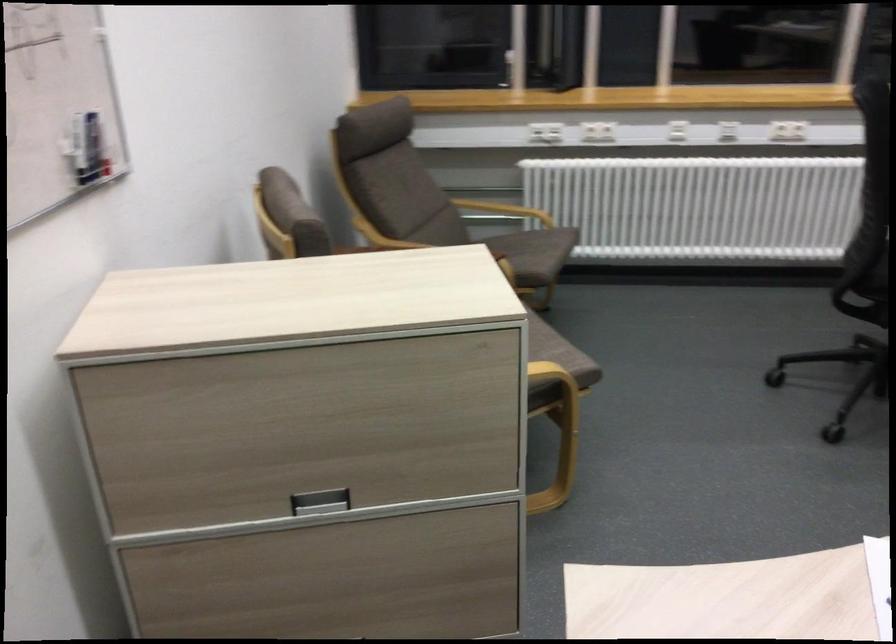
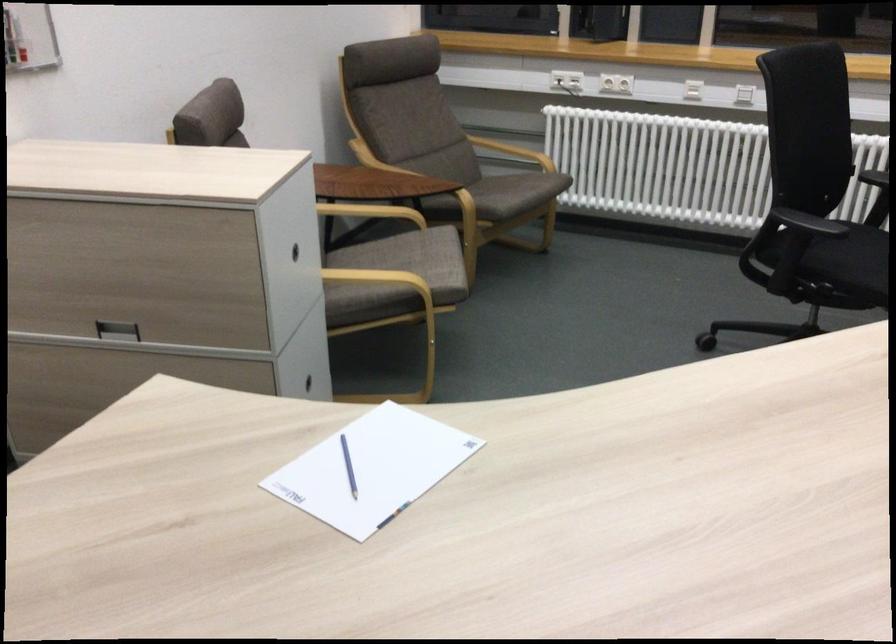
Locate, in the second image, the point that corresponds to pixel 308 500 in the first image.

(116, 330)